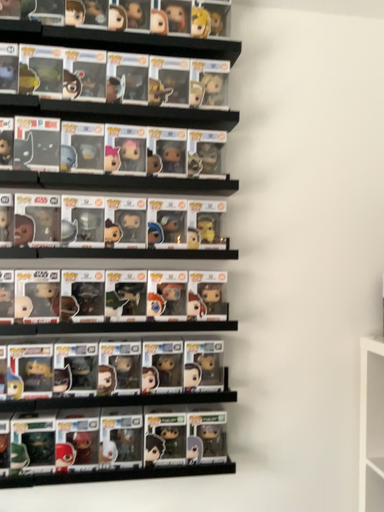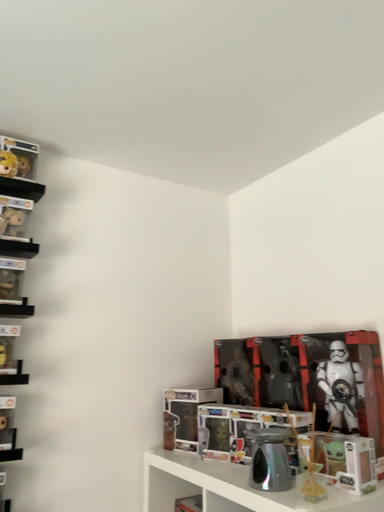
Question: Which way did the camera rotate in the video?

Choices:
 (A) rotated left
 (B) rotated right

Answer: (B)